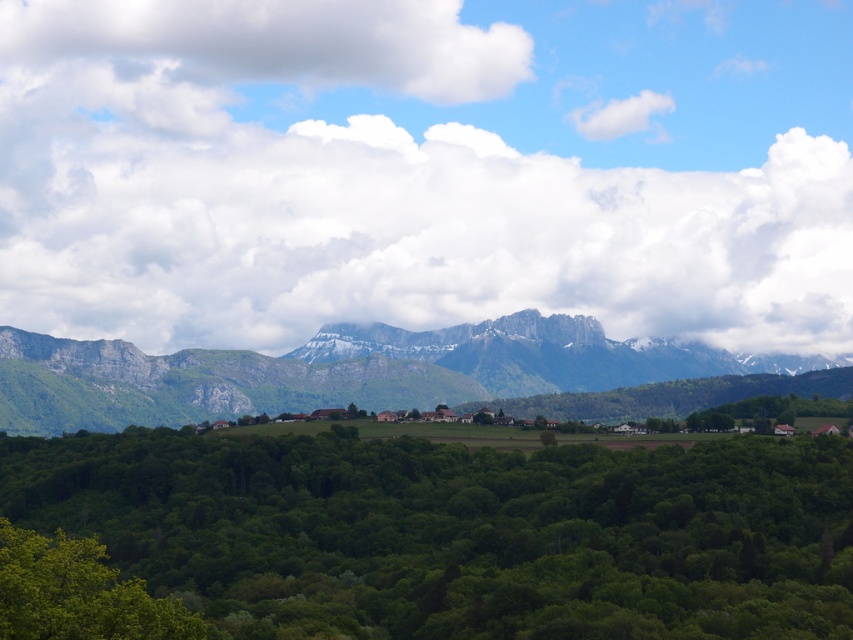
In order to click on green rock mountain range at center in this screenshot , I will do `click(346, 371)`.

Does green rock mountain range at center lie behind green leafy tree at lower left?

No.

Does point (453, 340) lie behind point (15, 618)?

That is False.

You are a GUI agent. You are given a task and a screenshot of the screen. Output one action in this format:
    pyautogui.click(x=<x>, y=<y>)
    Task: Click on the green rock mountain range at center
    This screenshot has width=853, height=640.
    Given the screenshot: What is the action you would take?
    pyautogui.click(x=346, y=371)

Where is `white fluffy cloud at upper center`? white fluffy cloud at upper center is located at coordinates (387, 225).

Which is above, white fluffy cloud at upper center or green leafy tree at center?

white fluffy cloud at upper center is above.

Locate an element on the screen. This screenshot has width=853, height=640. white fluffy cloud at upper center is located at coordinates (387, 225).

Image resolution: width=853 pixels, height=640 pixels. Identify the location of white fluffy cloud at upper center. (387, 225).

Consider the image. Does white fluffy cloud at upper center have a lesser width compared to green leafy trees at center?

In fact, white fluffy cloud at upper center might be wider than green leafy trees at center.

Between point (99, 298) and point (416, 502), which one is positioned behind?

Positioned behind is point (99, 298).

Where is `white fluffy cloud at upper center`? The width and height of the screenshot is (853, 640). white fluffy cloud at upper center is located at coordinates (387, 225).

This screenshot has height=640, width=853. Identify the location of white fluffy cloud at upper center. (387, 225).